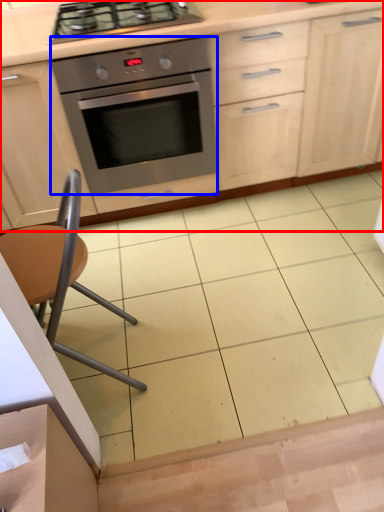
Question: Which object is closer to the camera taking this photo, cabinetry (highlighted by a red box) or oven (highlighted by a blue box)?

Choices:
 (A) cabinetry
 (B) oven

Answer: (A)